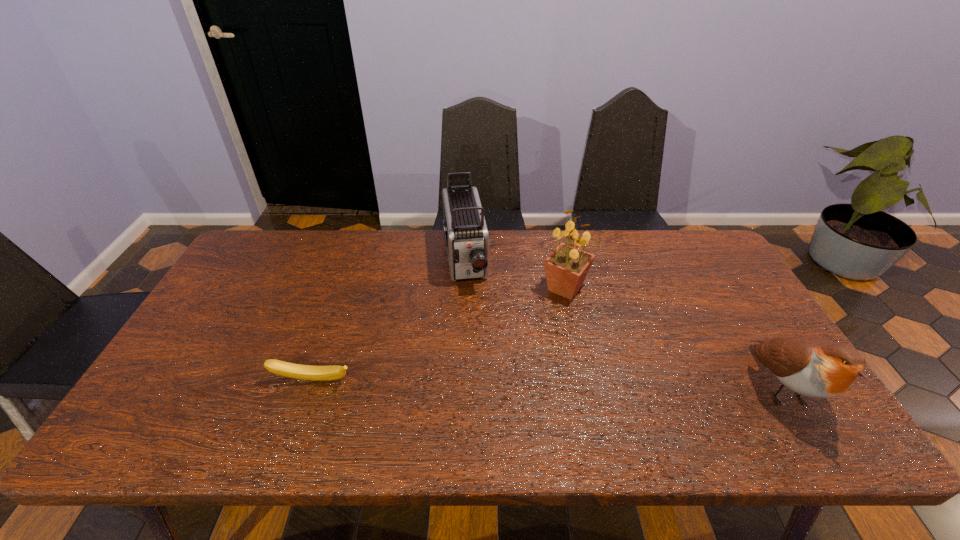
In the image, there is a desktop. Identify the location of free space at the right edge. Image resolution: width=960 pixels, height=540 pixels. (742, 322).

In the image, there is a desktop. In order to click on free space at the far right corner in this screenshot , I will do `click(675, 265)`.

This screenshot has height=540, width=960. Identify the location of vacant space at the near right corner. (759, 403).

I want to click on empty space between the sunflower and the leftmost object, so click(x=439, y=334).

Where is `unoccupied position between the camcorder and the rightmost object`? The image size is (960, 540). unoccupied position between the camcorder and the rightmost object is located at coordinates (623, 323).

Where is `empty space that is in between the third object from right to left and the banana`? Image resolution: width=960 pixels, height=540 pixels. empty space that is in between the third object from right to left and the banana is located at coordinates (389, 320).

The width and height of the screenshot is (960, 540). Identify the location of free point between the banana and the camcorder. (389, 320).

Identify the location of free space between the third object from right to left and the bird. The height and width of the screenshot is (540, 960). (623, 323).

Where is `blank region between the shortest object and the third object from right to left`? blank region between the shortest object and the third object from right to left is located at coordinates (389, 320).

What are the coordinates of `free space between the bird and the banana` in the screenshot? It's located at (547, 384).